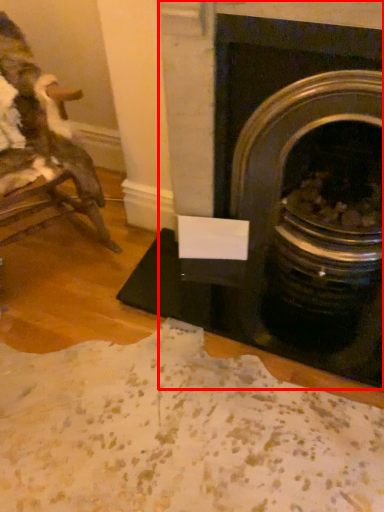
Question: From the image's perspective, what is the correct spatial relationship of fireplace (annotated by the red box) in relation to chair?

Choices:
 (A) below
 (B) above

Answer: (A)